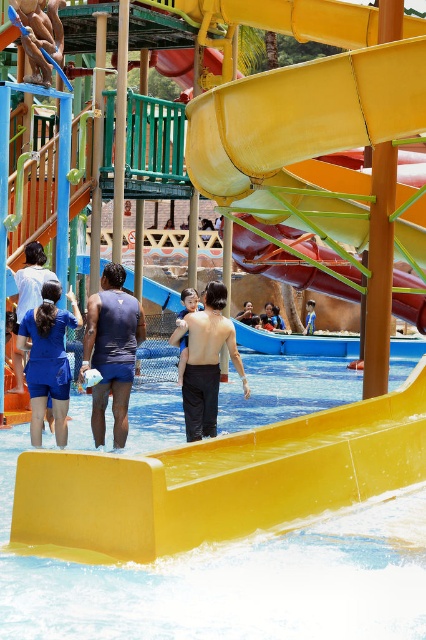
Is shiny black shorts at center bigger than blue fabric shorts at lower left?

No, shiny black shorts at center is not bigger than blue fabric shorts at lower left.

Who is more distant from viewer, (210, 330) or (60, 326)?

Positioned behind is point (60, 326).

Find the location of a particular element. The image size is (426, 640). shiny black shorts at center is located at coordinates (206, 362).

Does blue fabric shorts at lower left have a greater width compared to blue fabric shorts at center?

Yes, blue fabric shorts at lower left is wider than blue fabric shorts at center.

Does point (23, 332) come farther from viewer compared to point (313, 317)?

No, (23, 332) is closer to viewer.

At what (x,y) coordinates should I click in order to perform the action: click on blue fabric shorts at lower left. Please return your answer as a coordinate pair (x, y). Looking at the image, I should click on (48, 358).

Is yellow plastic pool at center shorter than blue fabric dress at left?

Yes.

Does yellow plastic pool at center have a lesser width compared to blue fabric dress at left?

No.

Between point (26, 436) and point (17, 349), which one is positioned in front?

Point (17, 349) is more forward.

Locate an element on the screen. Image resolution: width=426 pixels, height=640 pixels. yellow plastic pool at center is located at coordinates (230, 580).